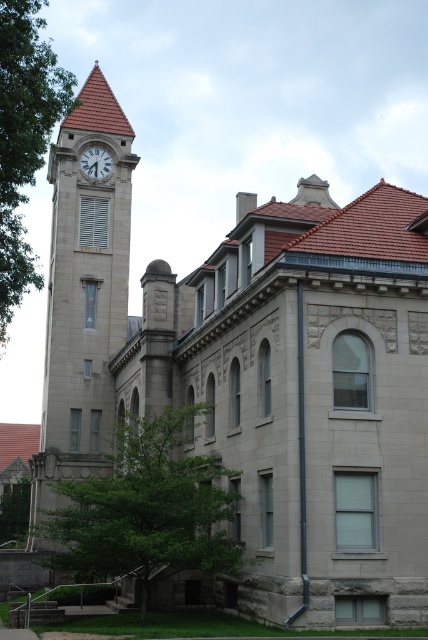
You are an architect planning to add a new pathway between the green leafy tree at lower center and the green leafy tree at left. Considering their sizes, which tree will require more space to accommodate its canopy?

The green leafy tree at lower center is bigger than the green leafy tree at left, so it will require more space to accommodate its canopy.